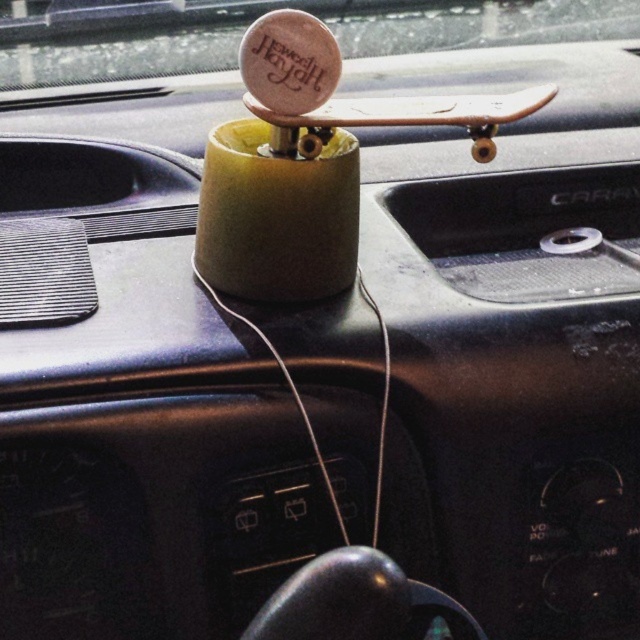
Question: Does wooden circle at upper center lie in front of wooden skateboard at center?

Choices:
 (A) no
 (B) yes

Answer: (A)

Question: Among these objects, which one is farthest from the camera?

Choices:
 (A) wooden circle at upper center
 (B) wooden skateboard at center

Answer: (A)

Question: Is wooden circle at upper center smaller than wooden skateboard at center?

Choices:
 (A) no
 (B) yes

Answer: (B)

Question: Which point is farther to the camera?

Choices:
 (A) wooden circle at upper center
 (B) wooden skateboard at center

Answer: (A)

Question: Is wooden circle at upper center positioned before wooden skateboard at center?

Choices:
 (A) yes
 (B) no

Answer: (B)